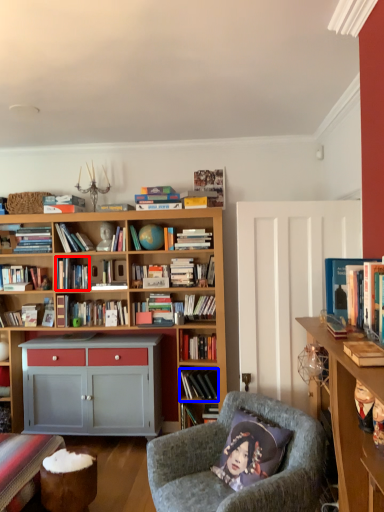
Question: Among these objects, which one is nearest to the camera, book (highlighted by a red box) or book (highlighted by a blue box)?

Choices:
 (A) book
 (B) book

Answer: (B)